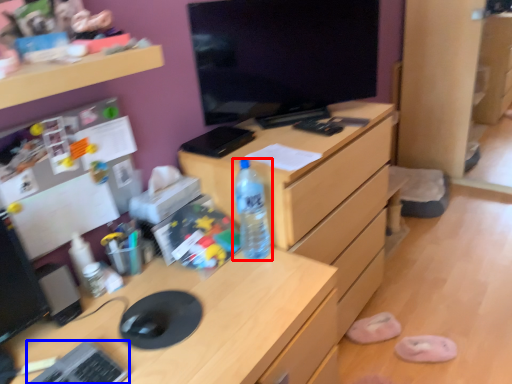
Question: Which object appears closest to the camera in this image, bottle (highlighted by a red box) or keyboard (highlighted by a blue box)?

Choices:
 (A) bottle
 (B) keyboard

Answer: (B)